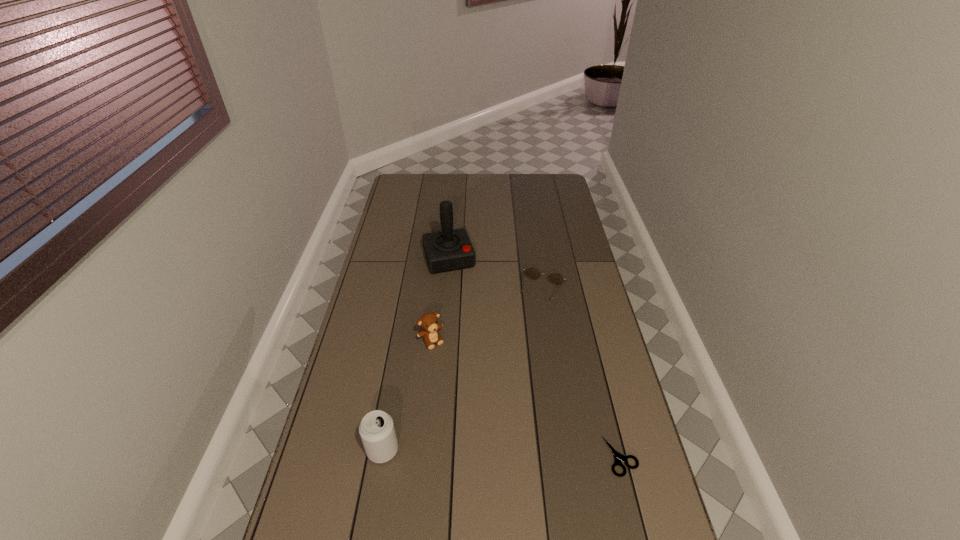
Where is `vacant area located on the back of the rightmost object`? Image resolution: width=960 pixels, height=540 pixels. vacant area located on the back of the rightmost object is located at coordinates (604, 387).

What are the coordinates of `vacant space located on the front-facing side of the second farthest object` in the screenshot? It's located at (511, 376).

Find the location of a particular element. vacant space located on the front-facing side of the second farthest object is located at coordinates [x=526, y=334].

The image size is (960, 540). I want to click on free space located 0.360m on the front-facing side of the second farthest object, so click(510, 379).

Image resolution: width=960 pixels, height=540 pixels. What are the coordinates of `blank space located on the base of the joystick` in the screenshot? It's located at (465, 306).

Locate an element on the screen. This screenshot has height=540, width=960. free space located on the base of the joystick is located at coordinates (468, 319).

I want to click on free space located on the base of the joystick, so click(x=458, y=287).

The height and width of the screenshot is (540, 960). In order to click on free space located on the face of the third shortest object in this screenshot , I will do `click(444, 359)`.

Locate an element on the screen. vacant space located 0.340m on the face of the third shortest object is located at coordinates (x=491, y=426).

At what (x,y) coordinates should I click in order to perform the action: click on blank space located on the face of the third shortest object. Please return your answer as a coordinate pair (x, y). Looking at the image, I should click on (456, 375).